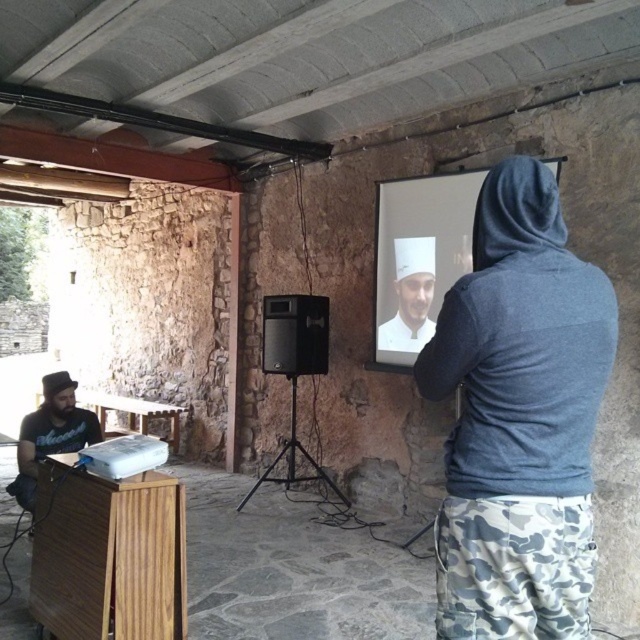
You are standing at the entrance of the room and want to move towards the point at coordinates point [387,189]. However, there is an obstacle at point [38,428]. Can you reach your destination without passing through the obstacle?

Point [387,189] is behind point [38,428], so you cannot reach the destination without passing through the obstacle at point [38,428].